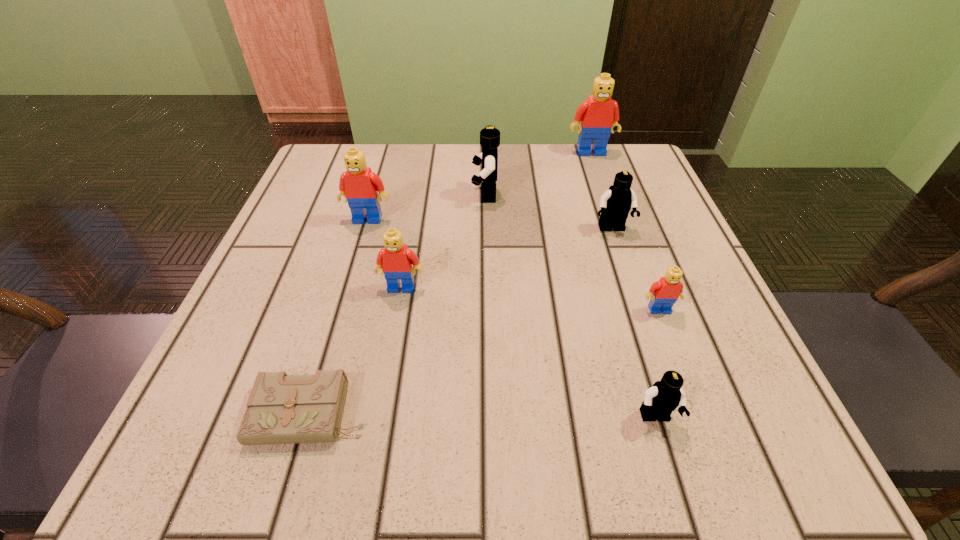
Identify which Lego is the third nearest to the farthest black Lego. Please provide its 2D coordinates. Your answer should be formatted as a tuple, i.e. [(x, y)], where the tuple contains the x and y coordinates of a point satisfying the conditions above.

[(598, 114)]

This screenshot has height=540, width=960. What are the coordinates of `the second closest red Lego to the fifth farthest Lego` in the screenshot? It's located at (664, 293).

This screenshot has height=540, width=960. What are the coordinates of `red Lego that is the second closest to the smallest black Lego` in the screenshot? It's located at (395, 260).

This screenshot has width=960, height=540. I want to click on black Lego that is the third closest to the shortest object, so click(617, 201).

Select which black Lego is the third closest to the diary. Please provide its 2D coordinates. Your answer should be formatted as a tuple, i.e. [(x, y)], where the tuple contains the x and y coordinates of a point satisfying the conditions above.

[(617, 201)]

Identify the location of vacant position in the image that satisfies the following two spatial constraints: 1. on the front-facing side of the leftmost black Lego; 2. on the face of the second red Lego from left to right. (486, 287).